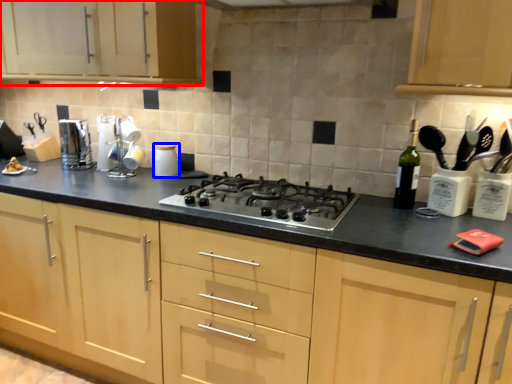
Question: Which object is further to the camera taking this photo, cabinetry (highlighted by a red box) or kitchen appliance (highlighted by a blue box)?

Choices:
 (A) cabinetry
 (B) kitchen appliance

Answer: (B)